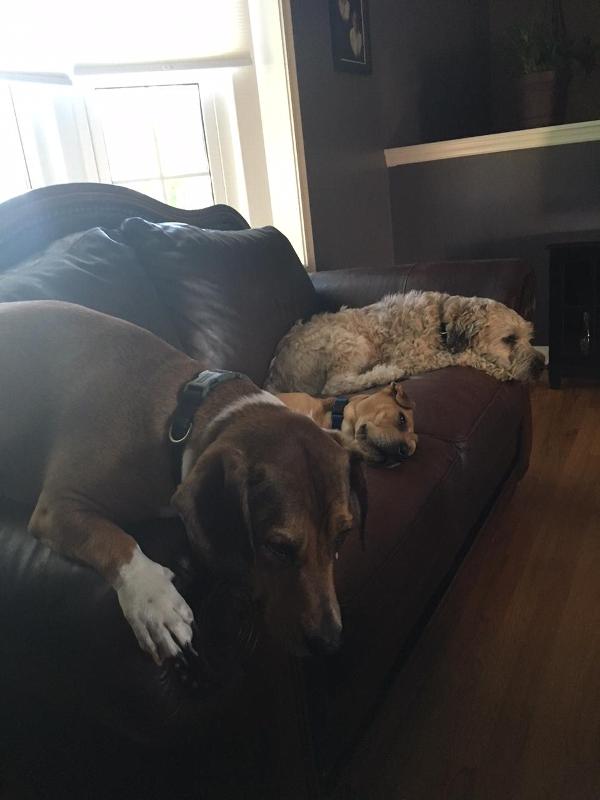
The width and height of the screenshot is (600, 800). In order to click on plant in this screenshot , I will do `click(543, 58)`.